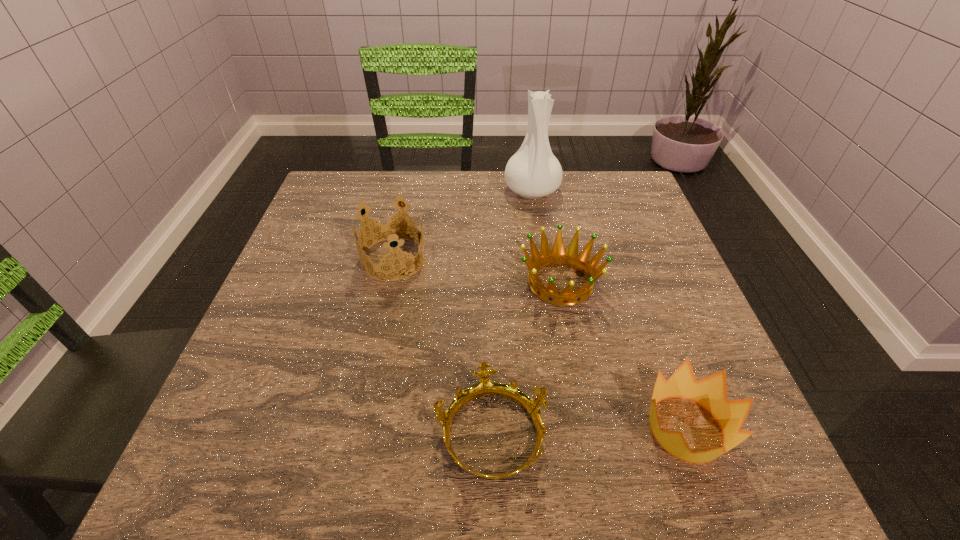
Where is `object that is at the near right corner`? The width and height of the screenshot is (960, 540). object that is at the near right corner is located at coordinates (710, 392).

At what (x,y) coordinates should I click in order to perform the action: click on vacant space at the far edge of the desktop. Please return your answer as a coordinate pair (x, y). Image resolution: width=960 pixels, height=540 pixels. Looking at the image, I should click on (394, 179).

This screenshot has width=960, height=540. In order to click on vacant space at the near edge of the desktop in this screenshot , I will do `click(548, 455)`.

You are a GUI agent. You are given a task and a screenshot of the screen. Output one action in this format:
    pyautogui.click(x=<x>, y=<y>)
    Task: Click on the vacant space at the left edge
    The height and width of the screenshot is (540, 960).
    Given the screenshot: What is the action you would take?
    pyautogui.click(x=341, y=245)

In the image, there is a desktop. At what (x,y) coordinates should I click in order to perform the action: click on vacant area at the right edge. Please return your answer as a coordinate pair (x, y). This screenshot has height=540, width=960. Looking at the image, I should click on (746, 423).

Identify the location of free space at the far left corner of the desktop. (322, 202).

This screenshot has height=540, width=960. I want to click on vacant space at the near left corner, so click(x=237, y=492).

You are a GUI agent. You are given a task and a screenshot of the screen. Output one action in this format:
    pyautogui.click(x=<x>, y=<y>)
    Task: Click on the vacant position at the far right corner of the desktop
    Image resolution: width=960 pixels, height=540 pixels.
    Given the screenshot: What is the action you would take?
    pyautogui.click(x=607, y=177)

You are a GUI agent. You are given a task and a screenshot of the screen. Output one action in this format:
    pyautogui.click(x=<x>, y=<y>)
    Task: Click on the unoccupied area between the vase and the second tallest object
    Image resolution: width=960 pixels, height=540 pixels.
    Given the screenshot: What is the action you would take?
    pyautogui.click(x=463, y=225)

I want to click on unoccupied position between the shortest object and the tallest crown, so click(x=443, y=346).